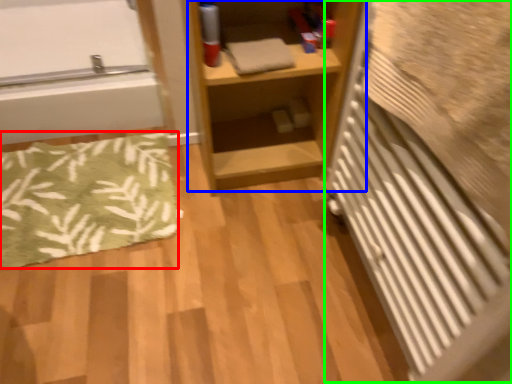
Question: Which is farther away from bath mat (highlighted by a red box)? shelf (highlighted by a blue box) or radiator (highlighted by a green box)?

Choices:
 (A) shelf
 (B) radiator

Answer: (B)